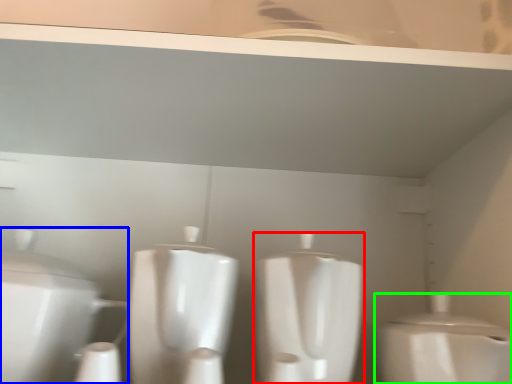
Question: Which is nearer to the toilet (highlighted by a red box)? toilet (highlighted by a blue box) or toilet (highlighted by a green box).

Choices:
 (A) toilet
 (B) toilet

Answer: (B)